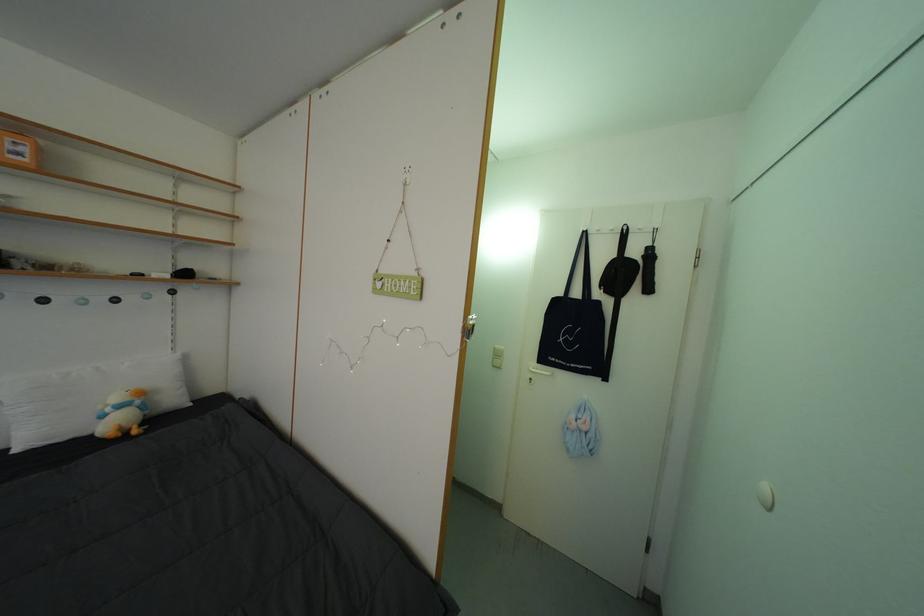
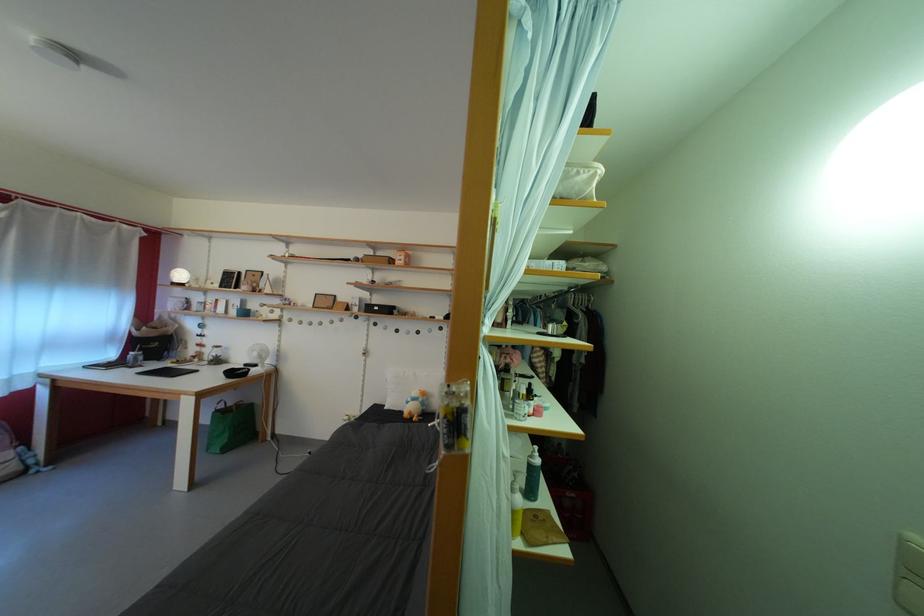
The point at (117, 415) is marked in the first image. Where is the corresponding point in the second image?

(418, 405)